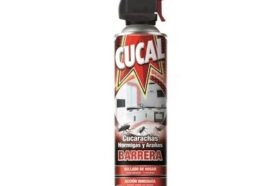
At what (x,y) coordinates should I click in order to perform the action: click on bottle. Please return your answer as a coordinate pair (x, y). This screenshot has width=280, height=186. Looking at the image, I should click on (124, 55).